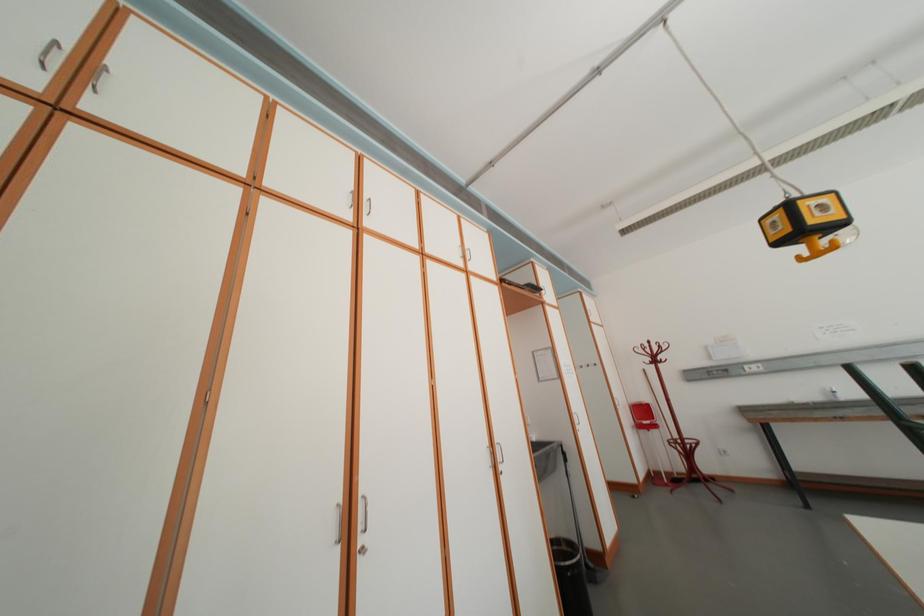
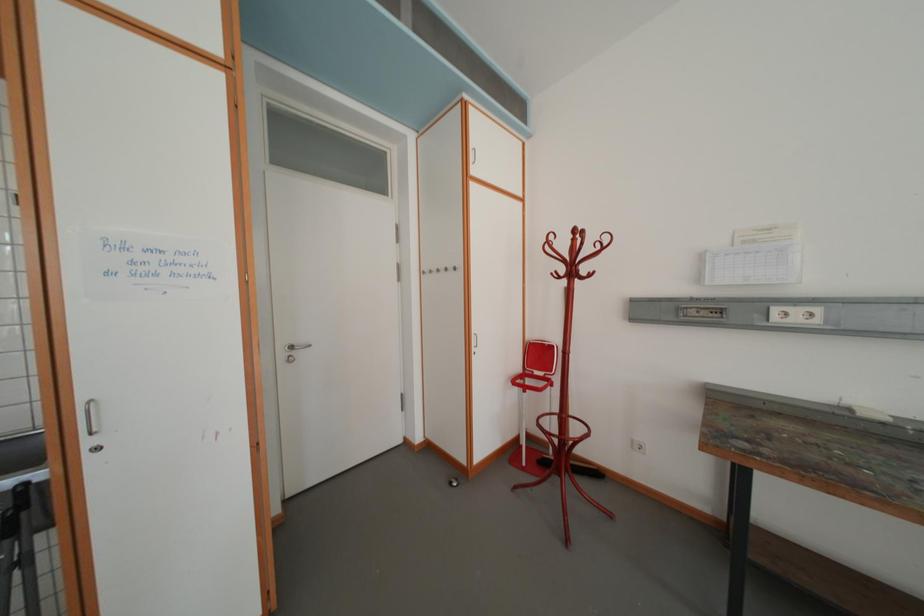
Which direction would the cameraman need to move to produce the second image?

The movement direction of the cameraman is right, forward.